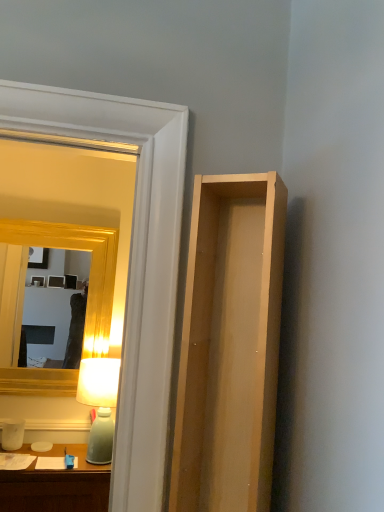
Question: Would you consider light wood cabinet at right to be distant from matte green glass table lamp at left?

Choices:
 (A) yes
 (B) no

Answer: (A)

Question: From the image's perspective, would you say light wood cabinet at right is positioned over matte green glass table lamp at left?

Choices:
 (A) no
 (B) yes

Answer: (B)

Question: Is light wood cabinet at right completely or partially outside of matte green glass table lamp at left?

Choices:
 (A) yes
 (B) no

Answer: (A)

Question: Considering the relative positions of light wood cabinet at right and matte green glass table lamp at left in the image provided, is light wood cabinet at right in front of matte green glass table lamp at left?

Choices:
 (A) yes
 (B) no

Answer: (A)

Question: Considering the relative positions of light wood cabinet at right and matte green glass table lamp at left in the image provided, is light wood cabinet at right to the left of matte green glass table lamp at left from the viewer's perspective?

Choices:
 (A) yes
 (B) no

Answer: (B)

Question: Considering the relative sizes of light wood cabinet at right and matte green glass table lamp at left in the image provided, is light wood cabinet at right shorter than matte green glass table lamp at left?

Choices:
 (A) yes
 (B) no

Answer: (B)

Question: Can you confirm if gold wooden mirror at upper left is shorter than clear glass door at upper left?

Choices:
 (A) yes
 (B) no

Answer: (A)

Question: From a real-world perspective, is gold wooden mirror at upper left beneath clear glass door at upper left?

Choices:
 (A) yes
 (B) no

Answer: (A)

Question: Would you say gold wooden mirror at upper left is outside clear glass door at upper left?

Choices:
 (A) yes
 (B) no

Answer: (A)

Question: Does gold wooden mirror at upper left have a smaller size compared to clear glass door at upper left?

Choices:
 (A) no
 (B) yes

Answer: (A)

Question: Is gold wooden mirror at upper left oriented towards clear glass door at upper left?

Choices:
 (A) no
 (B) yes

Answer: (B)

Question: Does gold wooden mirror at upper left have a greater height compared to clear glass door at upper left?

Choices:
 (A) yes
 (B) no

Answer: (B)

Question: From the image's perspective, would you say clear glass door at upper left is positioned over matte green glass table lamp at left?

Choices:
 (A) yes
 (B) no

Answer: (A)